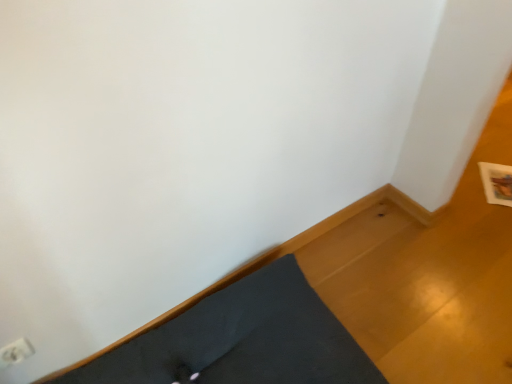
Identify the location of white plastic electric outlet at lower left. The image size is (512, 384). (15, 352).

Measure the distance between point (2, 347) and camera.

They are 3.39 feet apart.

What do you see at coordinates (15, 352) in the screenshot? I see `white plastic electric outlet at lower left` at bounding box center [15, 352].

What do you see at coordinates (241, 340) in the screenshot?
I see `dark gray fabric bed frame at lower left` at bounding box center [241, 340].

Where is `dark gray fabric bed frame at lower left`? This screenshot has height=384, width=512. dark gray fabric bed frame at lower left is located at coordinates (241, 340).

Measure the distance between dark gray fabric bed frame at lower left and camera.

A distance of 3.80 feet exists between dark gray fabric bed frame at lower left and camera.

Where is `white plastic electric outlet at lower left`? This screenshot has width=512, height=384. white plastic electric outlet at lower left is located at coordinates click(x=15, y=352).

Which is more to the right, dark gray fabric bed frame at lower left or white plastic electric outlet at lower left?

From the viewer's perspective, dark gray fabric bed frame at lower left appears more on the right side.

Does dark gray fabric bed frame at lower left come behind white plastic electric outlet at lower left?

No, dark gray fabric bed frame at lower left is closer to the viewer.

Does point (160, 366) lie in front of point (20, 356)?

No.

From the image's perspective, which one is positioned lower, dark gray fabric bed frame at lower left or white plastic electric outlet at lower left?

dark gray fabric bed frame at lower left.

From a real-world perspective, between dark gray fabric bed frame at lower left and white plastic electric outlet at lower left, who is vertically lower?

In real-world perspective, dark gray fabric bed frame at lower left is lower.

Based on the photo, does dark gray fabric bed frame at lower left have a lesser width compared to white plastic electric outlet at lower left?

No, dark gray fabric bed frame at lower left is not thinner than white plastic electric outlet at lower left.

Does dark gray fabric bed frame at lower left have a greater height compared to white plastic electric outlet at lower left?

Yes.

Does dark gray fabric bed frame at lower left have a smaller size compared to white plastic electric outlet at lower left?

No.

Is dark gray fabric bed frame at lower left completely or partially outside of white plastic electric outlet at lower left?

Yes.

Is there a large distance between dark gray fabric bed frame at lower left and white plastic electric outlet at lower left?

They are positioned close to each other.

Is white plastic electric outlet at lower left at the back of dark gray fabric bed frame at lower left?

No.

What's the angular difference between dark gray fabric bed frame at lower left and white plastic electric outlet at lower left's facing directions?

They differ by 3.31 degrees in their facing directions.

You are a GUI agent. You are given a task and a screenshot of the screen. Output one action in this format:
    pyautogui.click(x=<x>, y=<y>)
    Task: Click on the bed frame on the right side of white plastic electric outlet at lower left
    This screenshot has height=384, width=512.
    Given the screenshot: What is the action you would take?
    pyautogui.click(x=241, y=340)

Considering the positions of objects white plastic electric outlet at lower left and dark gray fabric bed frame at lower left in the image provided, who is more to the left, white plastic electric outlet at lower left or dark gray fabric bed frame at lower left?

Positioned to the left is white plastic electric outlet at lower left.

Is the position of white plastic electric outlet at lower left more distant than that of dark gray fabric bed frame at lower left?

Yes, white plastic electric outlet at lower left is further from the camera.

Which is more distant, (22,338) or (228,316)?

Positioned behind is point (228,316).

In the scene shown: From the image's perspective, between white plastic electric outlet at lower left and dark gray fabric bed frame at lower left, which one is located above?

white plastic electric outlet at lower left appears higher in the image.

From a real-world perspective, is white plastic electric outlet at lower left positioned above or below dark gray fabric bed frame at lower left?

white plastic electric outlet at lower left is above dark gray fabric bed frame at lower left.

Is white plastic electric outlet at lower left wider than dark gray fabric bed frame at lower left?

Incorrect, the width of white plastic electric outlet at lower left does not surpass that of dark gray fabric bed frame at lower left.

Is white plastic electric outlet at lower left taller than dark gray fabric bed frame at lower left?

In fact, white plastic electric outlet at lower left may be shorter than dark gray fabric bed frame at lower left.

Between white plastic electric outlet at lower left and dark gray fabric bed frame at lower left, which one has smaller size?

With smaller size is white plastic electric outlet at lower left.

Is white plastic electric outlet at lower left located outside dark gray fabric bed frame at lower left?

Yes, white plastic electric outlet at lower left is located beyond the bounds of dark gray fabric bed frame at lower left.

Are white plastic electric outlet at lower left and dark gray fabric bed frame at lower left beside each other?

No, white plastic electric outlet at lower left is not beside dark gray fabric bed frame at lower left.

Is dark gray fabric bed frame at lower left at the back of white plastic electric outlet at lower left?

white plastic electric outlet at lower left is not turned away from dark gray fabric bed frame at lower left.

From the picture: Can you tell me how much white plastic electric outlet at lower left and dark gray fabric bed frame at lower left differ in facing direction?

white plastic electric outlet at lower left and dark gray fabric bed frame at lower left are facing 3.31 degrees away from each other.

Find the location of `bed frame that is in front of the white plastic electric outlet at lower left`. bed frame that is in front of the white plastic electric outlet at lower left is located at coordinates (241, 340).

Find the location of `bed frame on the right of white plastic electric outlet at lower left`. bed frame on the right of white plastic electric outlet at lower left is located at coordinates (241, 340).

The height and width of the screenshot is (384, 512). What are the coordinates of `electric outlet located behind the dark gray fabric bed frame at lower left` in the screenshot? It's located at (15, 352).